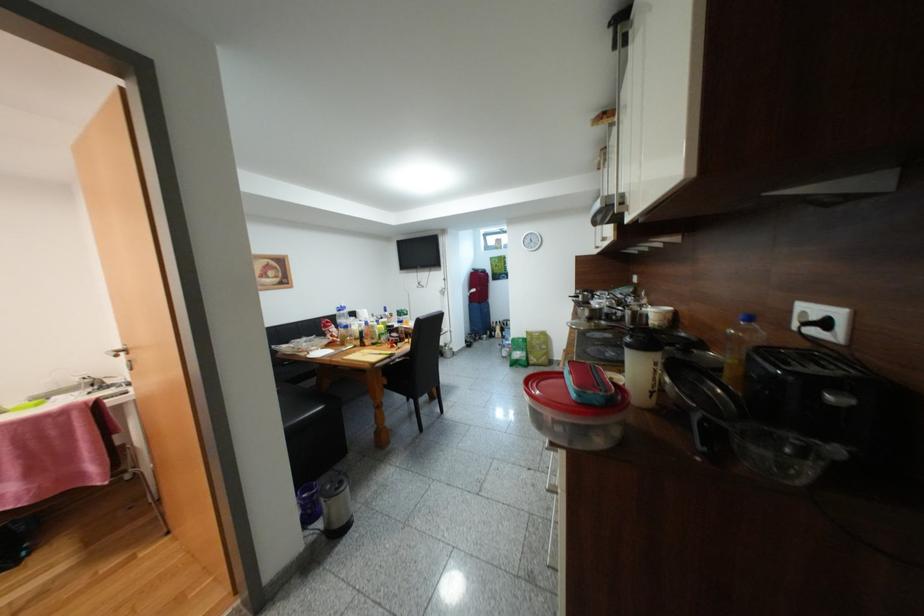
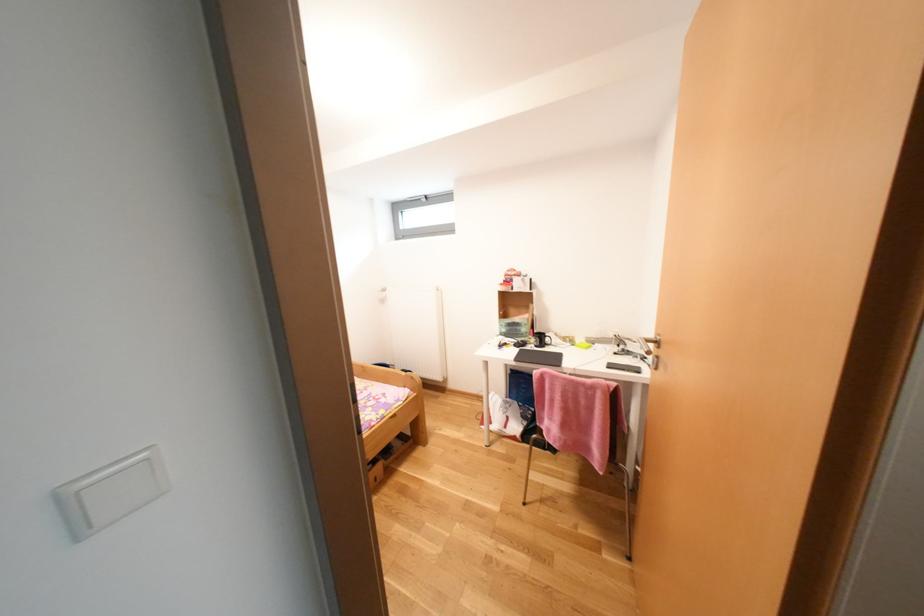
Question: The first image is from the beginning of the video and the second image is from the end. How did the camera likely rotate when shooting the video?

Choices:
 (A) Left
 (B) Right
 (C) Up
 (D) Down

Answer: (A)